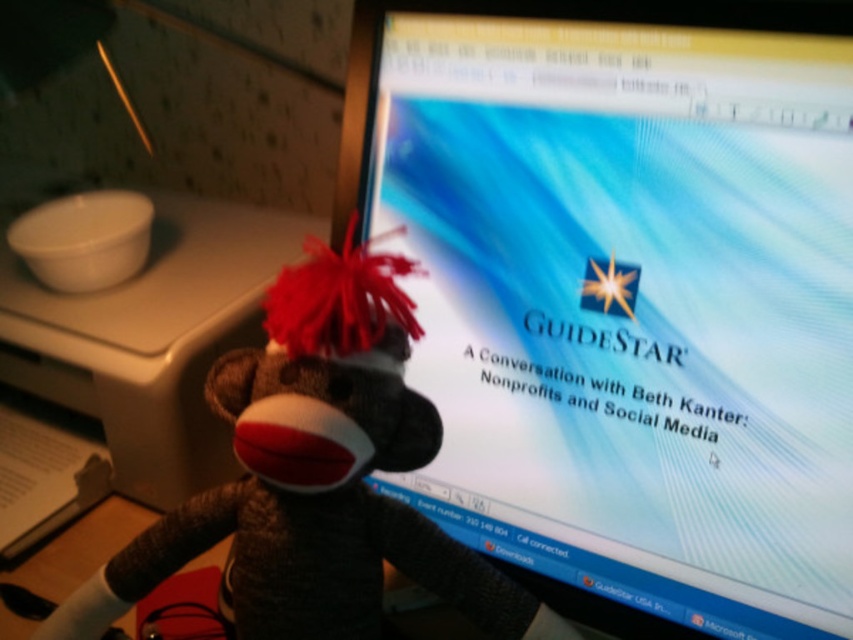
Does brown fuzzy sock monkey at center lie behind matte white plastic at left?

No, brown fuzzy sock monkey at center is in front of matte white plastic at left.

Between brown fuzzy sock monkey at center and matte white plastic at left, which one appears on the left side from the viewer's perspective?

matte white plastic at left is more to the left.

At what (x,y) coordinates should I click in order to perform the action: click on brown fuzzy sock monkey at center. Please return your answer as a coordinate pair (x, y). Looking at the image, I should click on (316, 476).

The image size is (853, 640). I want to click on brown fuzzy sock monkey at center, so click(316, 476).

Find the location of a particular element. matte plastic monitor at center is located at coordinates (625, 296).

What do you see at coordinates (625, 296) in the screenshot? I see `matte plastic monitor at center` at bounding box center [625, 296].

Which is in front, point (413, 35) or point (276, 448)?

Point (276, 448) is more forward.

Locate an element on the screen. Image resolution: width=853 pixels, height=640 pixels. matte plastic monitor at center is located at coordinates (625, 296).

Can you confirm if matte plastic monitor at center is smaller than matte white plastic at left?

Yes.

Is matte plastic monitor at center shorter than matte white plastic at left?

No, matte plastic monitor at center is not shorter than matte white plastic at left.

Where is `matte plastic monitor at center`? matte plastic monitor at center is located at coordinates (625, 296).

Find the location of a particular element. Image resolution: width=853 pixels, height=640 pixels. matte plastic monitor at center is located at coordinates (625, 296).